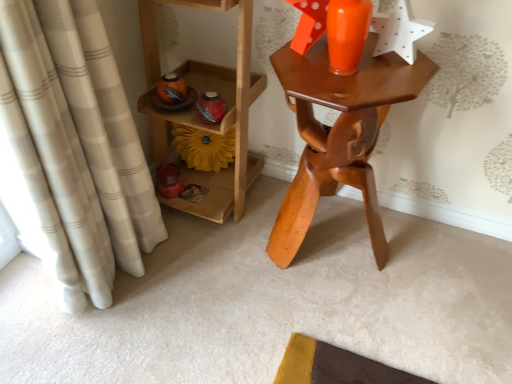
Question: Would you say beige plaid curtain at left is to the left or to the right of wooden shelf at left in the picture?

Choices:
 (A) left
 (B) right

Answer: (A)

Question: Based on their sizes in the image, would you say beige plaid curtain at left is bigger or smaller than wooden shelf at left?

Choices:
 (A) small
 (B) big

Answer: (A)

Question: Which object is positioned farthest from the wooden shelf at left?

Choices:
 (A) yellow fabric flower at center
 (B) beige plaid curtain at left
 (C) wooden table at center

Answer: (B)

Question: Considering the real-world distances, which object is closest to the wooden table at center?

Choices:
 (A) wooden shelf at left
 (B) beige plaid curtain at left
 (C) yellow fabric flower at center

Answer: (A)